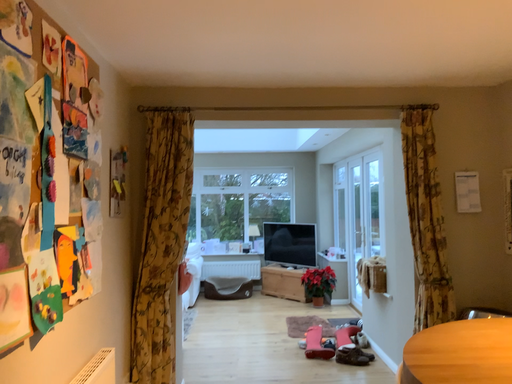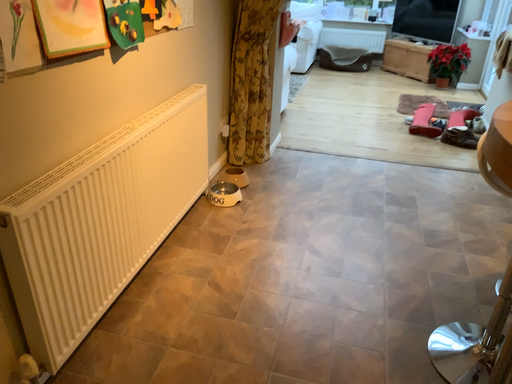
Question: How did the camera likely rotate when shooting the video?

Choices:
 (A) rotated downward
 (B) rotated upward

Answer: (A)